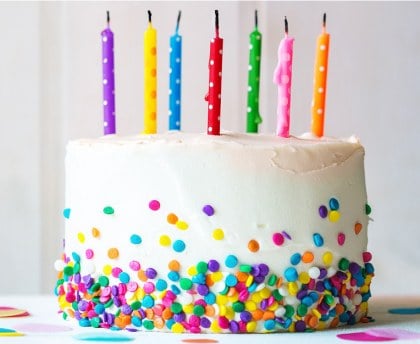
I want to click on wax drips, so click(206, 97), click(261, 119), click(277, 76), click(279, 46), click(208, 65).